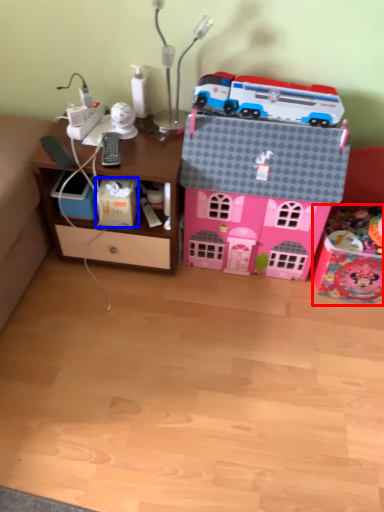
Question: Among these objects, which one is nearest to the camera, toy (highlighted by a red box) or cardboard box (highlighted by a blue box)?

Choices:
 (A) toy
 (B) cardboard box

Answer: (A)